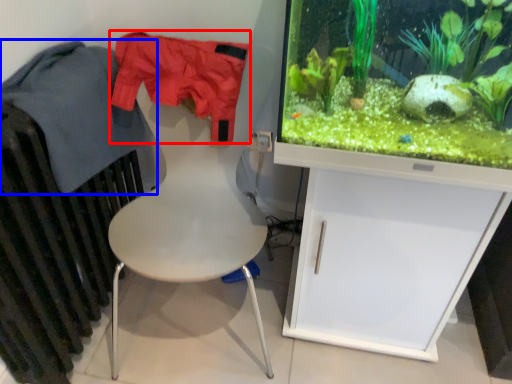
Question: Which object appears closest to the camera in this image, clothing (highlighted by a red box) or clothing (highlighted by a blue box)?

Choices:
 (A) clothing
 (B) clothing

Answer: (B)